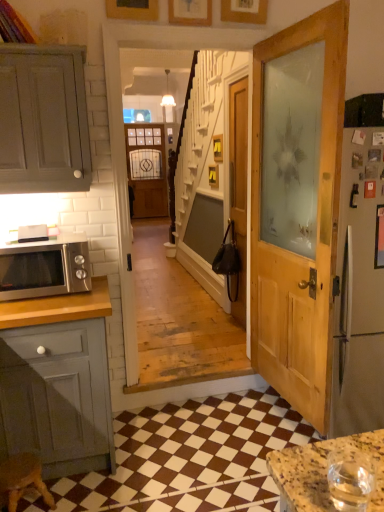
Question: Is brown checkered tile at lower center at the back of wooden door at center?

Choices:
 (A) no
 (B) yes

Answer: (A)

Question: From the image's perspective, is wooden door at center under brown checkered tile at lower center?

Choices:
 (A) yes
 (B) no

Answer: (B)

Question: Is wooden door at center not close to brown checkered tile at lower center?

Choices:
 (A) no
 (B) yes

Answer: (B)

Question: Is brown checkered tile at lower center located within wooden door at center?

Choices:
 (A) no
 (B) yes

Answer: (A)

Question: Considering the relative positions of wooden door at center and brown checkered tile at lower center in the image provided, is wooden door at center to the right of brown checkered tile at lower center from the viewer's perspective?

Choices:
 (A) yes
 (B) no

Answer: (A)

Question: Can we say wooden door at center lies outside brown checkered tile at lower center?

Choices:
 (A) yes
 (B) no

Answer: (A)

Question: Is matte wooden screen door at center turned away from wooden picture frame at upper center, which is counted as the second picture frame, starting from the right?

Choices:
 (A) yes
 (B) no

Answer: (B)

Question: Is matte wooden screen door at center not inside wooden picture frame at upper center, marked as the 2th picture frame in a left-to-right arrangement?

Choices:
 (A) yes
 (B) no

Answer: (A)

Question: Can you confirm if matte wooden screen door at center is bigger than wooden picture frame at upper center, which is counted as the second picture frame, starting from the right?

Choices:
 (A) no
 (B) yes

Answer: (B)

Question: From a real-world perspective, is matte wooden screen door at center over wooden picture frame at upper center, marked as the 2th picture frame in a left-to-right arrangement?

Choices:
 (A) yes
 (B) no

Answer: (B)

Question: Does matte wooden screen door at center lie behind wooden picture frame at upper center, which is counted as the second picture frame, starting from the right?

Choices:
 (A) yes
 (B) no

Answer: (A)

Question: Could you tell me if matte wooden screen door at center is facing wooden picture frame at upper center, which is counted as the second picture frame, starting from the right?

Choices:
 (A) no
 (B) yes

Answer: (B)

Question: Is wooden picture frame at upper center, the 3th picture frame viewed from the right, inside wooden door at center?

Choices:
 (A) no
 (B) yes

Answer: (A)